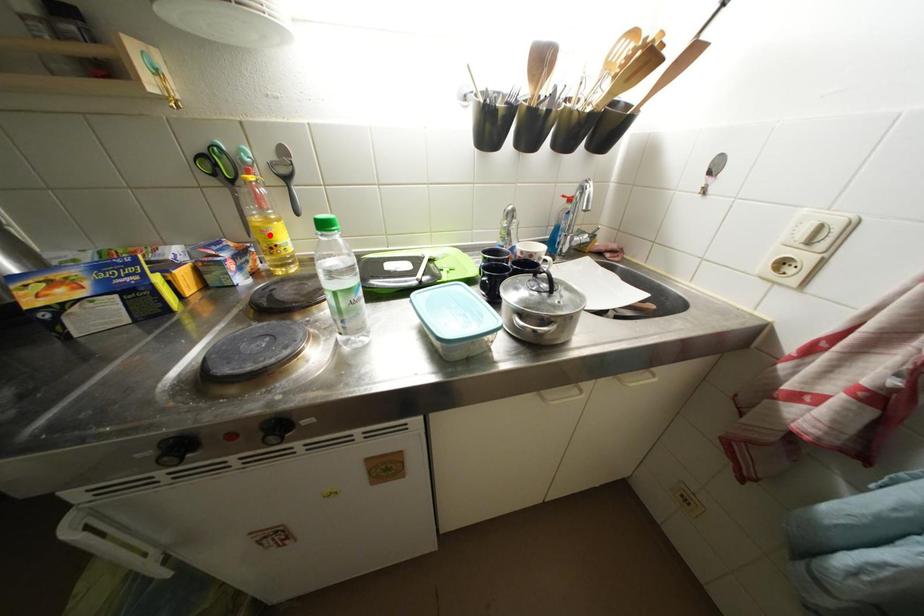
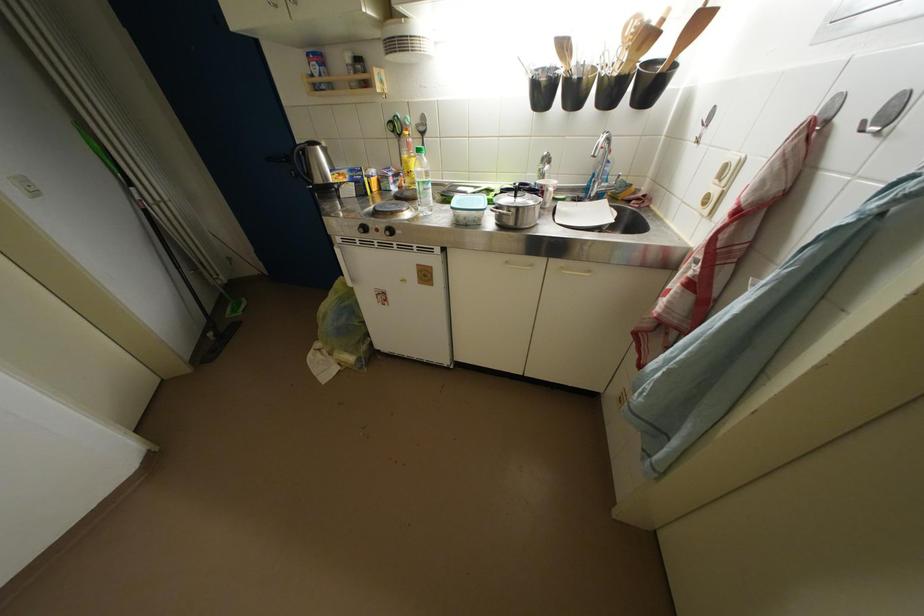
The point at the highlighted location is marked in the first image. Where is the corresponding point in the second image?

(412, 167)